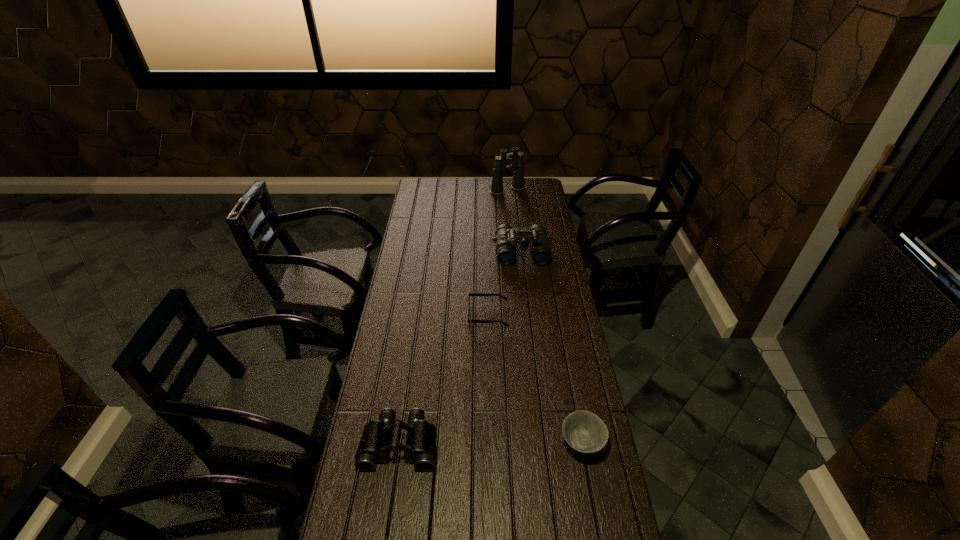
You are a GUI agent. You are given a task and a screenshot of the screen. Output one action in this format:
    pyautogui.click(x=<x>, y=<y>)
    Task: Click on the free space at the far edge of the desktop
    
    Given the screenshot: What is the action you would take?
    pyautogui.click(x=505, y=195)

Find the location of a particular element. free spot at the left edge of the desktop is located at coordinates (423, 298).

The image size is (960, 540). Identify the location of vacant space at the right edge of the desktop. (563, 465).

Find the location of a particular element. This screenshot has height=540, width=960. empty location between the fourth tallest object and the tallest binoculars is located at coordinates (544, 316).

You are a GUI agent. You are given a task and a screenshot of the screen. Output one action in this format:
    pyautogui.click(x=<x>, y=<y>)
    Task: Click on the free space that is in between the leftmost object and the second shortest binoculars
    This screenshot has height=540, width=960.
    Given the screenshot: What is the action you would take?
    click(461, 348)

The height and width of the screenshot is (540, 960). What are the coordinates of `free space between the nearest binoculars and the bowl` in the screenshot? It's located at (491, 443).

I want to click on blank region between the spectacles and the fourth tallest object, so click(535, 379).

Identify the location of free space between the shortest binoculars and the farthest binoculars. This screenshot has height=540, width=960. (454, 316).

Identify the location of vacant area that lies between the spectacles and the leftmost object. This screenshot has width=960, height=540. (444, 380).

This screenshot has height=540, width=960. In order to click on vacant area between the second farthest binoculars and the farthest binoculars in this screenshot , I will do click(515, 221).